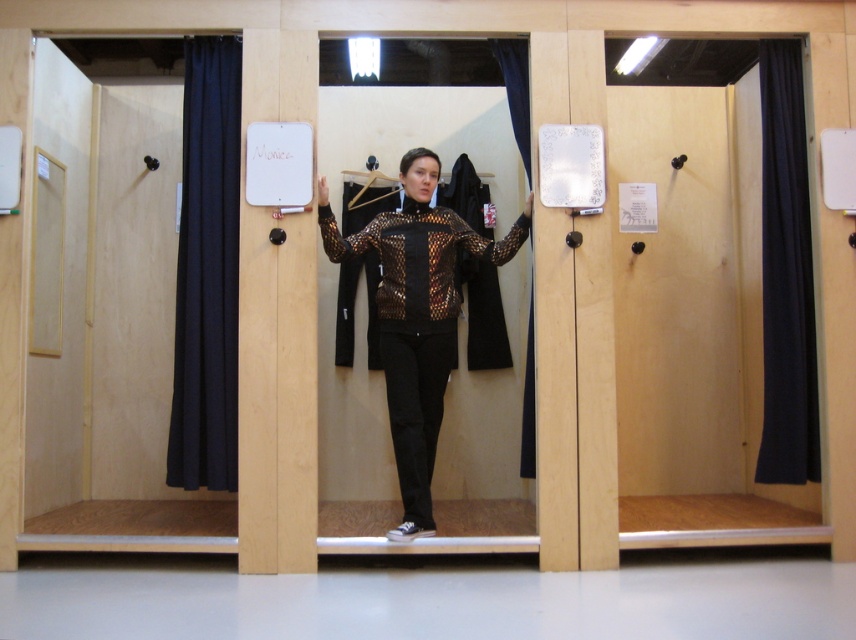
In the scene shown: You are trying to hang the leopard print jacket at center in the stall where the dark blue fabric curtain at right is located. Considering their sizes, will the jacket fit on the curtain rod without folding?

The leopard print jacket at center is wider than the dark blue fabric curtain at right, so it may not fit on the curtain rod without folding unless the rod is extended or adjusted.

You are standing in the dressing room and need to exit through the door. The door is located at the point with coordinates (x=207, y=272). There is a black fabric curtain at left blocking your path. Can you move around the curtain to reach the door?

The black fabric curtain at left is represented by the point (x=207, y=272), so the curtain is exactly at the door location. You cannot move around it because it is blocking the door directly.

You are organizing a fashion show and need to decide which item to display first. Based on their sizes, should the leopard print jacket at center be placed before the dark blue fabric curtain at right?

The leopard print jacket at center is larger in size than the dark blue fabric curtain at right, so it should be displayed first based on size.